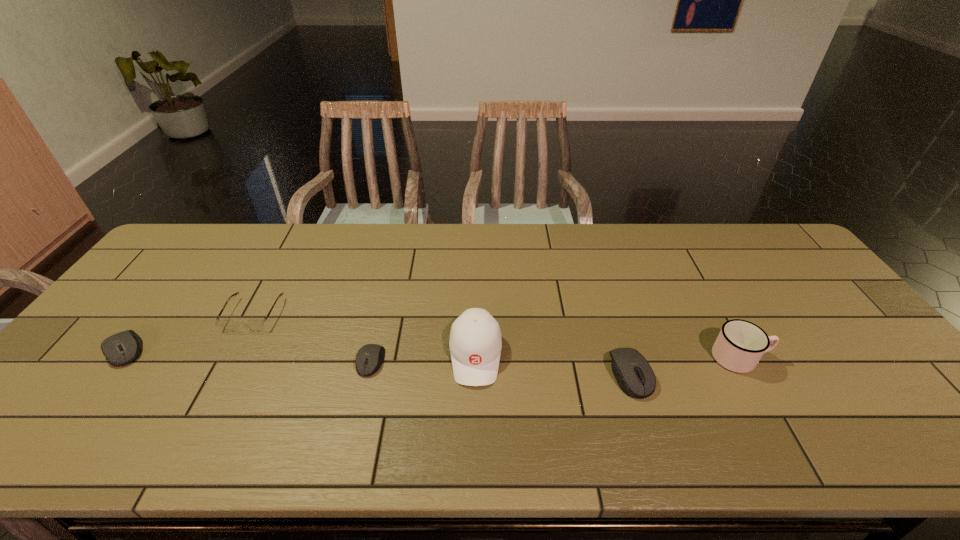
Identify the location of the leftmost computer equipment. This screenshot has height=540, width=960. (120, 349).

The width and height of the screenshot is (960, 540). I want to click on the leftmost object, so click(120, 349).

The image size is (960, 540). In order to click on the fourth object from right to left in this screenshot , I will do `click(370, 357)`.

Identify the location of the shortest computer equipment. (370, 357).

Find the location of `the rightmost computer equipment`. the rightmost computer equipment is located at coordinates point(634,375).

At what (x,y) coordinates should I click in order to perform the action: click on the second object from right to left. Please return your answer as a coordinate pair (x, y). This screenshot has width=960, height=540. Looking at the image, I should click on (634, 375).

What are the coordinates of `the second object from left to right` in the screenshot? It's located at (255, 325).

Where is `the rightmost object`? the rightmost object is located at coordinates (740, 345).

Where is `mug`? This screenshot has width=960, height=540. mug is located at coordinates (740, 345).

At what (x,y) coordinates should I click in order to perform the action: click on baseball cap. Please return your answer as a coordinate pair (x, y). Image resolution: width=960 pixels, height=540 pixels. Looking at the image, I should click on (475, 343).